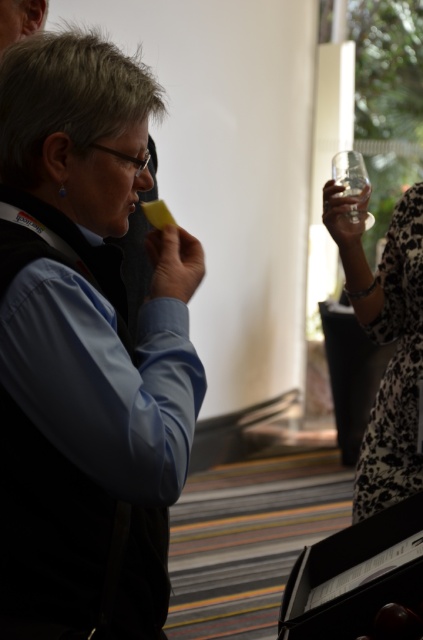
Question: Estimate the real-world distances between objects in this image. Which object is closer to the clear plastic cup at upper right?

Choices:
 (A) transparent glass at upper right
 (B) matte black vest at center

Answer: (A)

Question: Which point is farther to the camera?

Choices:
 (A) transparent glass at upper right
 (B) matte black vest at center
 (C) clear plastic cup at upper right

Answer: (C)

Question: Is matte black vest at center closer to camera compared to clear plastic cup at upper right?

Choices:
 (A) no
 (B) yes

Answer: (B)

Question: Which point is farther to the camera?

Choices:
 (A) matte black vest at center
 (B) clear plastic cup at upper right
 (C) transparent glass at upper right

Answer: (B)

Question: Can you confirm if matte black vest at center is smaller than clear plastic cup at upper right?

Choices:
 (A) no
 (B) yes

Answer: (A)

Question: Does matte black vest at center come in front of clear plastic cup at upper right?

Choices:
 (A) no
 (B) yes

Answer: (B)